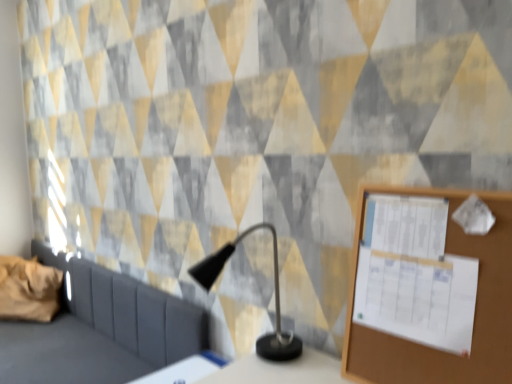
Question: From the image's perspective, is white glossy table at lower center positioned above or below black matte table lamp at center?

Choices:
 (A) below
 (B) above

Answer: (A)

Question: From their relative heights in the image, would you say white glossy table at lower center is taller or shorter than black matte table lamp at center?

Choices:
 (A) short
 (B) tall

Answer: (A)

Question: Based on their relative distances, which object is nearer to the wooden bulletin board at right?

Choices:
 (A) black matte table lamp at center
 (B) brown fabric pillow at left
 (C) white glossy table at lower center
 (D) dark gray fabric sofa at left

Answer: (A)

Question: Which of these objects is positioned closest to the brown fabric pillow at left?

Choices:
 (A) white glossy table at lower center
 (B) wooden bulletin board at right
 (C) black matte table lamp at center
 (D) dark gray fabric sofa at left

Answer: (D)